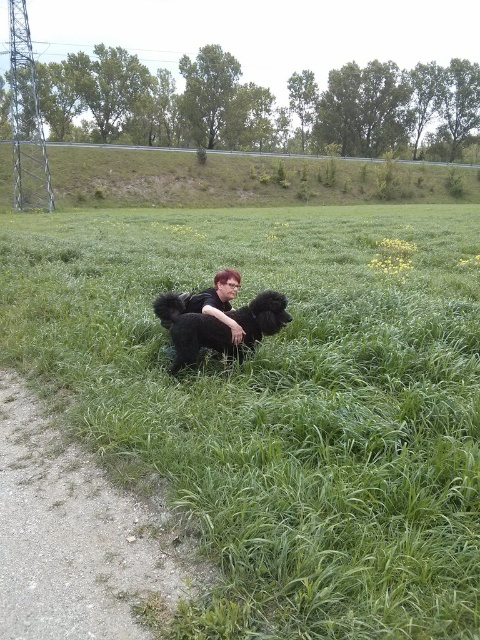
Based on the photo, you are a photographer planning to take a portrait of the person and the black poodle in the scene. Considering the green grassy field at center and the shiny black hair at center, which object would be more visible in the foreground?

The green grassy field at center is taller than shiny black hair at center, so the green grassy field at center would be more visible in the foreground.

You are standing at the point with coordinates point (x=211, y=304) and want to walk towards the point labeled point (x=12, y=275). Based on the scene description, will you be moving closer to the camera or further away from it?

Since point (x=12, y=275) is further to the camera than point (x=211, y=304), moving from point (x=211, y=304) towards point (x=12, y=275) would mean you are moving closer to the camera.